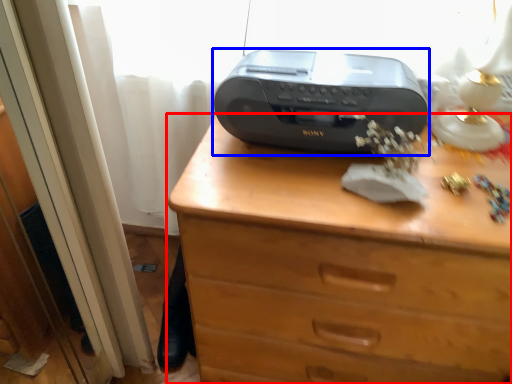
Question: Which object is closer to the camera taking this photo, chest of drawers (highlighted by a red box) or printer (highlighted by a blue box)?

Choices:
 (A) chest of drawers
 (B) printer

Answer: (A)